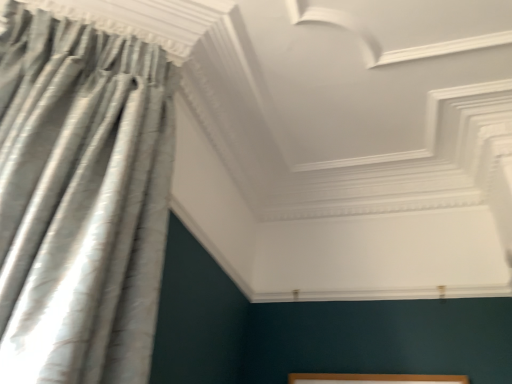
The height and width of the screenshot is (384, 512). What do you see at coordinates (81, 200) in the screenshot?
I see `silvery textured curtain at left` at bounding box center [81, 200].

The image size is (512, 384). Identify the location of silvery textured curtain at left. (81, 200).

Where is `silvery textured curtain at left`? This screenshot has width=512, height=384. silvery textured curtain at left is located at coordinates (81, 200).